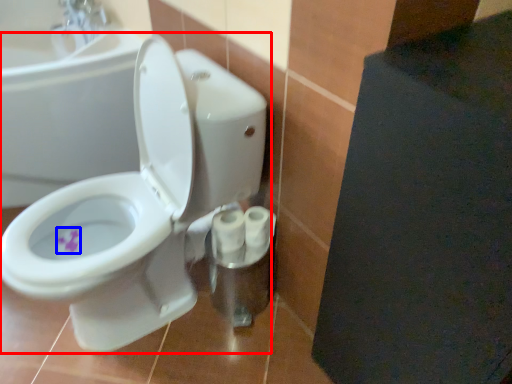
Question: Which object is further to the camera taking this photo, toilet (highlighted by a red box) or flower (highlighted by a blue box)?

Choices:
 (A) toilet
 (B) flower

Answer: (B)